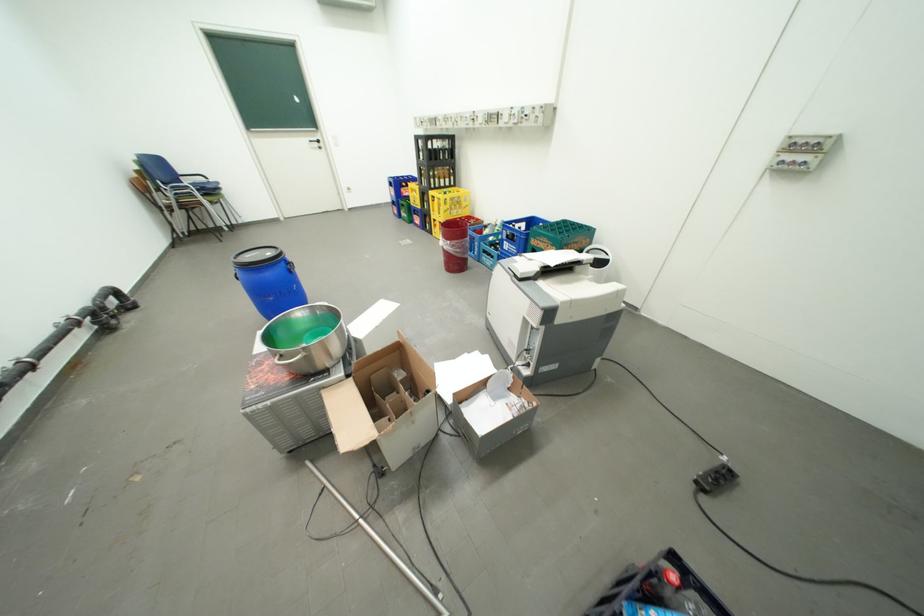
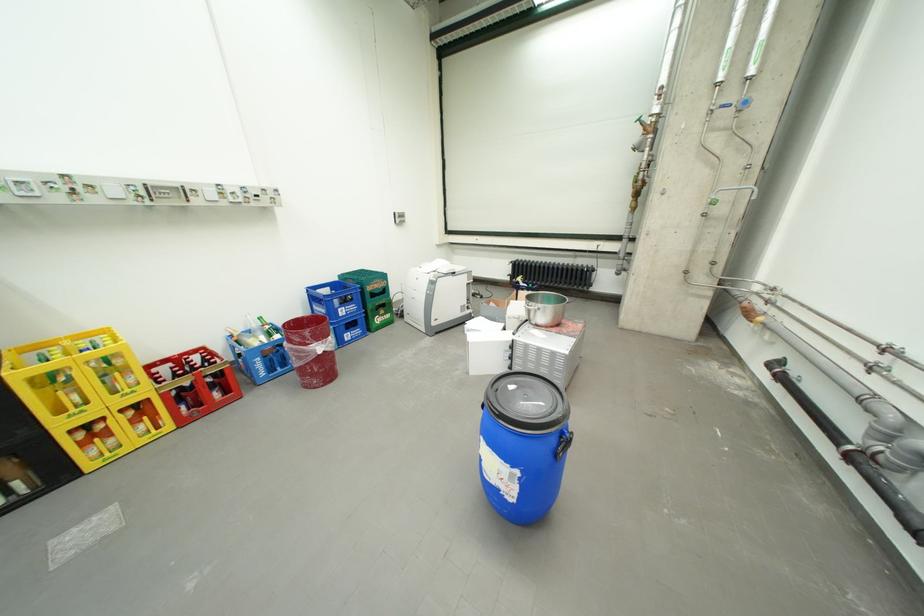
Find the pixel in the second image that matches [469,225] in the first image.

(297, 328)